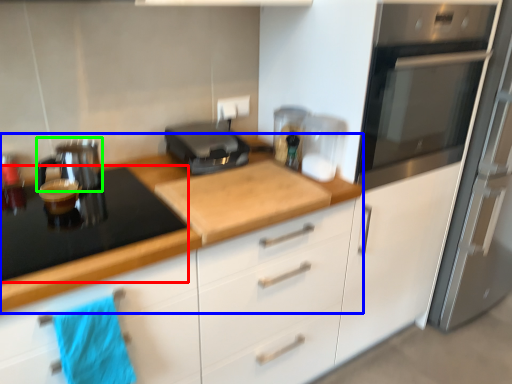
Question: Which object is the closest to the gas stove (highlighted by a red box)? Choose among these: countertop (highlighted by a blue box) or kitchen appliance (highlighted by a green box).

Choices:
 (A) countertop
 (B) kitchen appliance

Answer: (A)